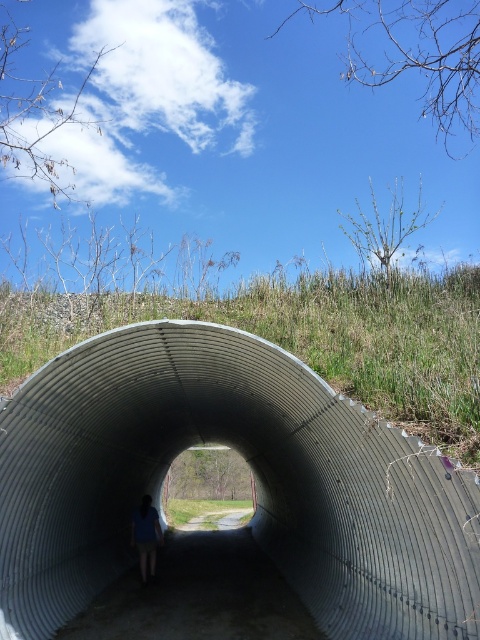
Which of these two, metallic silver tunnel at center or blue fabric shirt at center, stands shorter?

Standing shorter between the two is blue fabric shirt at center.

Is the position of metallic silver tunnel at center less distant than that of blue fabric shirt at center?

Yes.

Between point (444, 600) and point (153, 538), which one is positioned behind?

Positioned behind is point (153, 538).

You are a GUI agent. You are given a task and a screenshot of the screen. Output one action in this format:
    pyautogui.click(x=<x>, y=<y>)
    Task: Click on the metallic silver tunnel at center
    
    Given the screenshot: What is the action you would take?
    pyautogui.click(x=253, y=477)